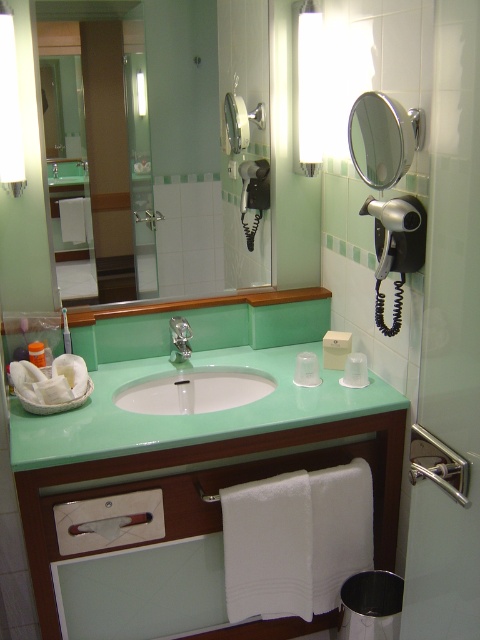
Question: Where is white fabric hand towel at center located in relation to clear plastic cup at center in the image?

Choices:
 (A) above
 (B) below

Answer: (A)

Question: From the image, what is the correct spatial relationship of green glossy vanity at center in relation to satin nickel faucet at sink center?

Choices:
 (A) left
 (B) right

Answer: (B)

Question: Which point is closer to the camera?

Choices:
 (A) (285, 422)
 (B) (36, 356)
 (C) (269, 28)
 (D) (80, 205)

Answer: (A)

Question: Is green glossy vanity at center in front of white fabric hand towel at lower center?

Choices:
 (A) no
 (B) yes

Answer: (B)

Question: Which of these objects is positioned farthest from the mint green glossy sink at center?

Choices:
 (A) metallic circular mirror at upper right
 (B) white fabric hand towel at center
 (C) white textured towel at lower center

Answer: (A)

Question: Among these points, which one is farthest from the camera?

Choices:
 (A) (190, 328)
 (B) (113, 518)
 (C) (34, 352)
 (D) (208, 42)

Answer: (A)